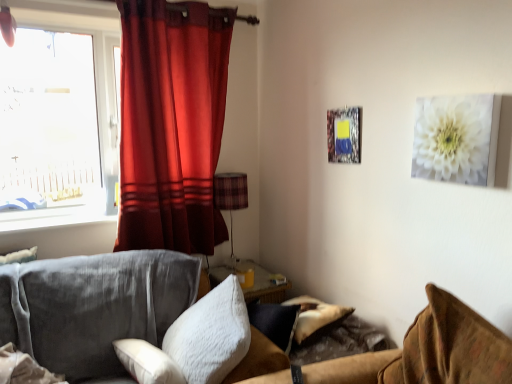
Question: From a real-world perspective, is white fluffy pillow at center, which is the first pillow in right-to-left order, physically below transparent glass window at upper left?

Choices:
 (A) no
 (B) yes

Answer: (B)

Question: Is white fluffy pillow at center, the second pillow viewed from the left, outside of transparent glass window at upper left?

Choices:
 (A) no
 (B) yes

Answer: (B)

Question: Can transparent glass window at upper left be found inside white fluffy pillow at center, which is the first pillow in right-to-left order?

Choices:
 (A) yes
 (B) no

Answer: (B)

Question: Considering the relative sizes of white fluffy pillow at center, the second pillow viewed from the left, and transparent glass window at upper left in the image provided, is white fluffy pillow at center, the second pillow viewed from the left, shorter than transparent glass window at upper left?

Choices:
 (A) no
 (B) yes

Answer: (B)

Question: Considering the relative positions of white fluffy pillow at center, the second pillow viewed from the left, and transparent glass window at upper left in the image provided, is white fluffy pillow at center, the second pillow viewed from the left, to the left of transparent glass window at upper left from the viewer's perspective?

Choices:
 (A) yes
 (B) no

Answer: (B)

Question: From the image's perspective, relative to white fluffy pillow at center, the second pillow viewed from the left, is plaid fabric lampshade at center above or below?

Choices:
 (A) below
 (B) above

Answer: (B)

Question: From a real-world perspective, is plaid fabric lampshade at center physically located above or below white fluffy pillow at center, which is the first pillow in right-to-left order?

Choices:
 (A) below
 (B) above

Answer: (B)

Question: Based on their sizes in the image, would you say plaid fabric lampshade at center is bigger or smaller than white fluffy pillow at center, which is the first pillow in right-to-left order?

Choices:
 (A) small
 (B) big

Answer: (A)

Question: Which is correct: plaid fabric lampshade at center is inside white fluffy pillow at center, which is the first pillow in right-to-left order, or outside of it?

Choices:
 (A) inside
 (B) outside

Answer: (B)

Question: From a real-world perspective, is white glossy window sill at left above or below white matte canvas at upper right?

Choices:
 (A) below
 (B) above

Answer: (A)

Question: Considering the positions of white glossy window sill at left and white matte canvas at upper right in the image, is white glossy window sill at left taller or shorter than white matte canvas at upper right?

Choices:
 (A) short
 (B) tall

Answer: (A)

Question: From the image's perspective, is white glossy window sill at left positioned above or below white matte canvas at upper right?

Choices:
 (A) above
 (B) below

Answer: (B)

Question: Considering the positions of white glossy window sill at left and white matte canvas at upper right in the image, is white glossy window sill at left wider or thinner than white matte canvas at upper right?

Choices:
 (A) wide
 (B) thin

Answer: (A)

Question: From the image's perspective, relative to white glossy window sill at left, is white fluffy pillow at center, which is the first pillow in right-to-left order, above or below?

Choices:
 (A) above
 (B) below

Answer: (B)

Question: Do you think white fluffy pillow at center, the second pillow viewed from the left, is within white glossy window sill at left, or outside of it?

Choices:
 (A) outside
 (B) inside

Answer: (A)